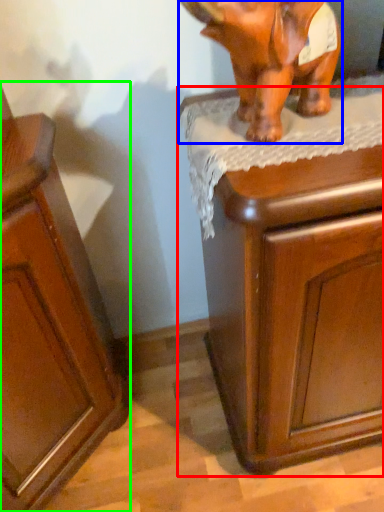
Question: Estimate the real-world distances between objects in this image. Which object is closer to chest of drawers (highlighted by a red box), elephant (highlighted by a blue box) or cabinetry (highlighted by a green box)?

Choices:
 (A) elephant
 (B) cabinetry

Answer: (A)